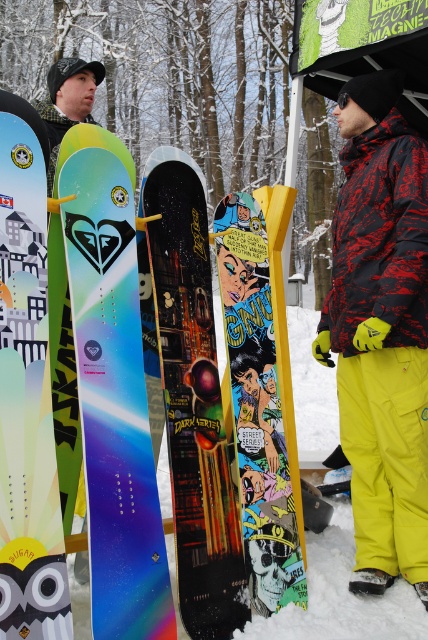
Is point (416, 256) farther from camera compared to point (234, 595)?

Yes, it is.

Is the position of yellow matte snow pants at lower right more distant than that of dark matte snowboard at center?

Yes, yellow matte snow pants at lower right is behind dark matte snowboard at center.

Is point (419, 138) farther from camera compared to point (220, 438)?

Yes, it is behind point (220, 438).

Find the location of a particular element. This screenshot has height=640, width=428. yellow matte snow pants at lower right is located at coordinates (380, 330).

Can you confirm if dark matte snowboard at center is positioned above comic book yellow snowboard at center?

Yes.

From the picture: Is dark matte snowboard at center shorter than comic book yellow snowboard at center?

No.

Between point (160, 308) and point (264, 417), which one is positioned in front?

Point (160, 308)

Where is `dark matte snowboard at center`? This screenshot has height=640, width=428. dark matte snowboard at center is located at coordinates (193, 400).

Which is above, yellow matte snow pants at lower right or shiny blue snowboard at center?

yellow matte snow pants at lower right is higher up.

Which is more to the left, yellow matte snow pants at lower right or shiny blue snowboard at center?

From the viewer's perspective, shiny blue snowboard at center appears more on the left side.

Measure the distance between point (398, 508) and camera.

Point (398, 508) is 10.37 feet away from camera.

Image resolution: width=428 pixels, height=640 pixels. In order to click on yellow matte snow pants at lower right in this screenshot , I will do `click(380, 330)`.